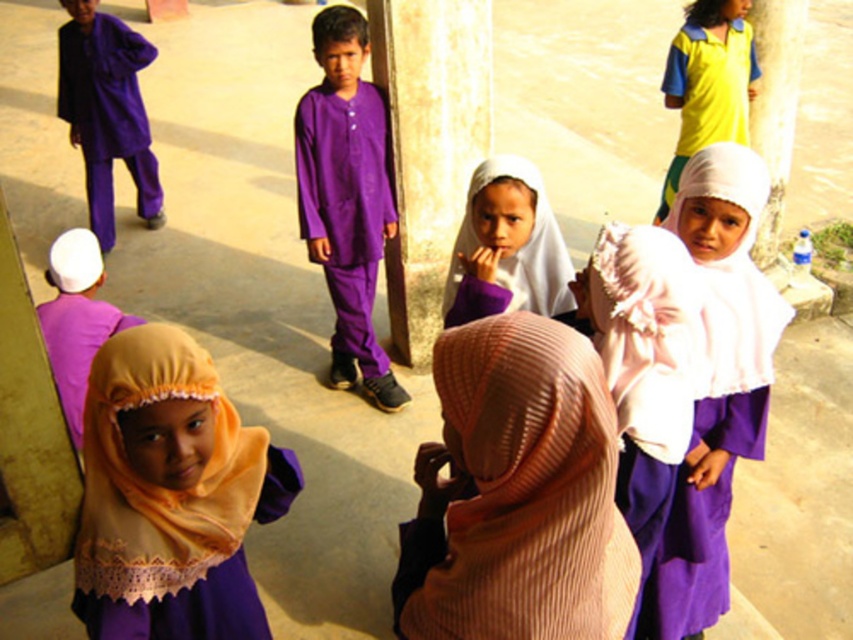
You are a photographer trying to capture a clear shot of the white sheer hijab at center without the pink striped hijab at center blocking it. What should you do?

Move your camera position to the side so that the pink striped hijab at center is no longer in front of the white sheer hijab at center. Since the pink striped hijab at center is currently blocking the view, adjusting your angle could allow you to see the white sheer hijab at center clearly.

You are standing at the point with coordinates point (135, 488) and want to walk to point (758, 340). Which direction should you move to reach your destination?

You should move backward to reach point (758, 340) because point (135, 488) is in front of it.

From the picture: You are a photographer trying to capture a group photo of the children. You notice the pink striped hijab at center and the white sheer hijab at center. Which one should you focus on first if you want to ensure both are in the frame without moving the camera?

Answer: The pink striped hijab at center is positioned on the left side of white sheer hijab at center, so focusing on the pink striped hijab at center first will ensure both are included in the frame as they are aligned horizontally.